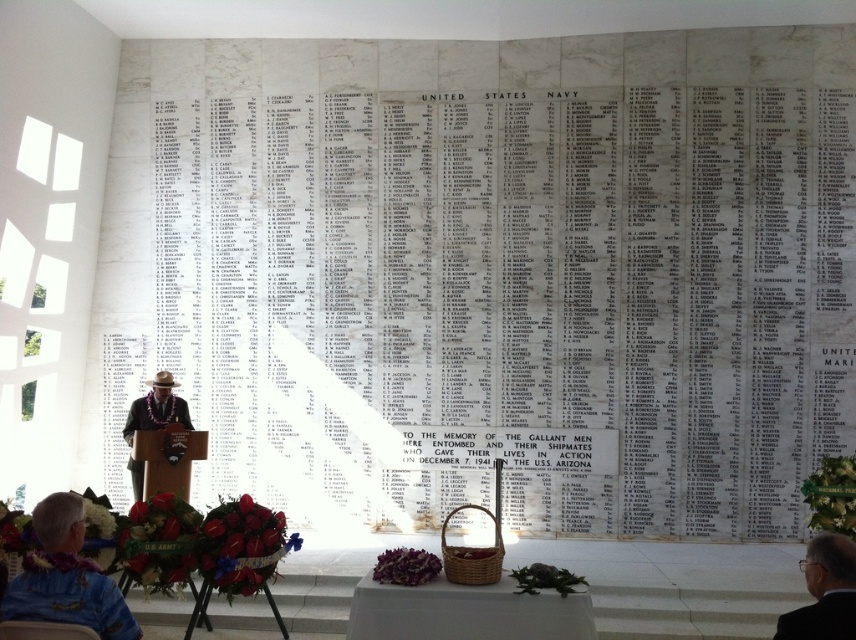
Can you confirm if white fabric at lower left is wider than wooden chair at lower left?

Indeed, white fabric at lower left has a greater width compared to wooden chair at lower left.

Does white fabric at lower left have a larger size compared to wooden chair at lower left?

Correct, white fabric at lower left is larger in size than wooden chair at lower left.

Measure the distance between point (61,589) and camera.

The distance of point (61,589) from camera is 3.69 meters.

I want to click on white fabric at lower left, so click(x=64, y=577).

Can you confirm if black leather jacket at lower right is bigger than matte brown hat at center?

No.

Which is more to the left, black leather jacket at lower right or matte brown hat at center?

From the viewer's perspective, matte brown hat at center appears more on the left side.

The height and width of the screenshot is (640, 856). Describe the element at coordinates (824, 592) in the screenshot. I see `black leather jacket at lower right` at that location.

Where is `black leather jacket at lower right`? The image size is (856, 640). black leather jacket at lower right is located at coordinates (824, 592).

Based on the photo, can you confirm if white fabric at lower left is thinner than matte brown hat at center?

Yes, white fabric at lower left is thinner than matte brown hat at center.

Does white fabric at lower left appear on the left side of matte brown hat at center?

Incorrect, white fabric at lower left is not on the left side of matte brown hat at center.

Is point (70, 589) positioned before point (177, 413)?

Yes, point (70, 589) is closer to viewer.

The height and width of the screenshot is (640, 856). I want to click on white fabric at lower left, so click(x=64, y=577).